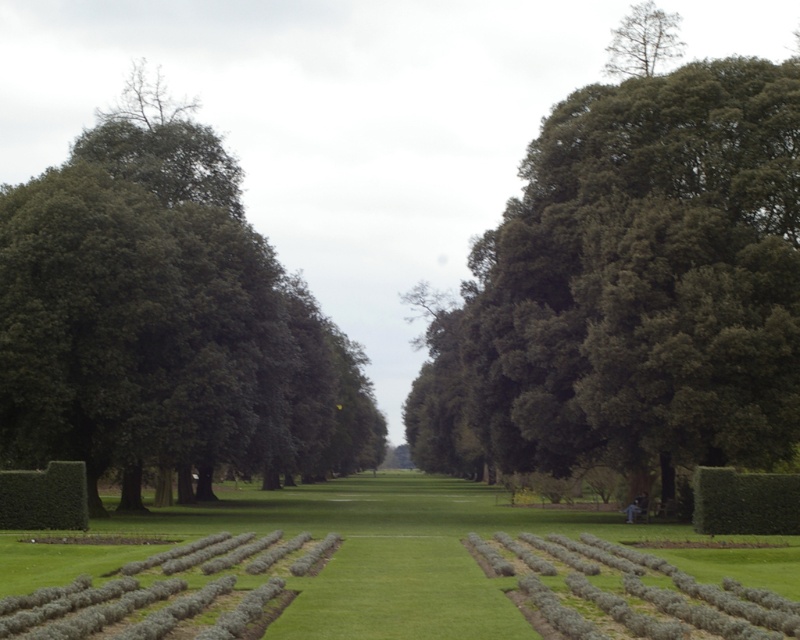
You are standing at the starting point of the pathway in the park. You see two points marked on the ground ahead of you. The first point is labeled as point (329,509) and the second point is labeled as point (34,500). Which of these two points is closer to you?

Point (34,500) is closer to you because it is positioned closer to the camera than point (329,509), which is further away.

You are standing at the starting point of the pathway in the park and see two points marked on the ground ahead of you. The first point is labeled as point (73, 444) and the second as point (22, 552). Which of these two points is closer to your current position?

Point (22, 552) is closer to your current position because it is less further to the camera than point (73, 444).

You are standing at the start of the pathway in the park and want to know which object is taller between the green leafy tree at center and the green shrubbery at lower left. Can you tell me?

The green leafy tree at center is taller than the green shrubbery at lower left.